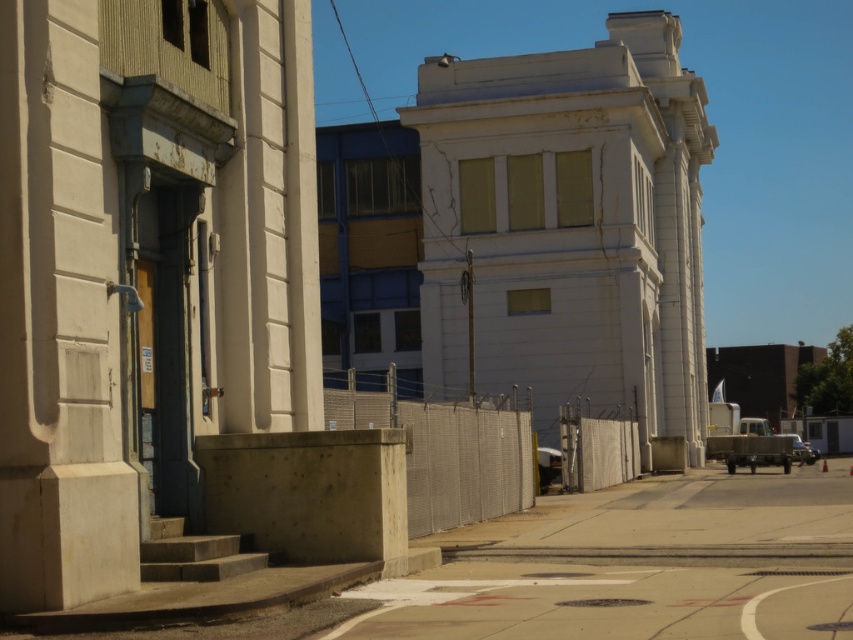
Question: Is concrete pavement at center to the left of white concrete pillar at left from the viewer's perspective?

Choices:
 (A) yes
 (B) no

Answer: (B)

Question: Which of the following is the closest to the observer?

Choices:
 (A) (646, 524)
 (B) (59, 371)

Answer: (B)

Question: Which of the following is the farthest from the observer?

Choices:
 (A) [x=90, y=3]
 (B) [x=779, y=497]

Answer: (B)

Question: Is concrete pavement at center to the left of white concrete pillar at left from the viewer's perspective?

Choices:
 (A) yes
 (B) no

Answer: (B)

Question: From the image, what is the correct spatial relationship of concrete pavement at center in relation to white concrete pillar at left?

Choices:
 (A) left
 (B) right

Answer: (B)